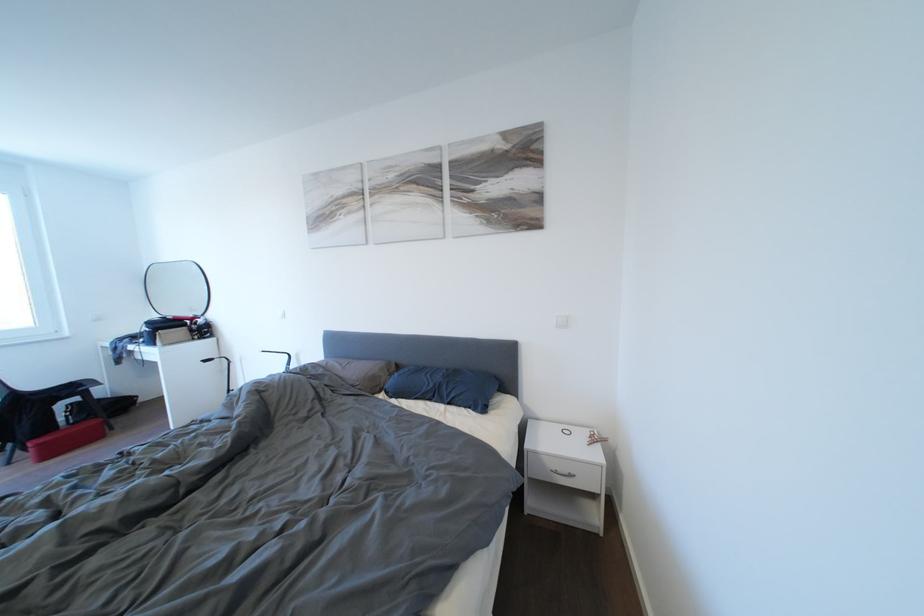
Find where to push the white light switch. Please return your answer as a coordinate pair (x, y).

(562, 321)